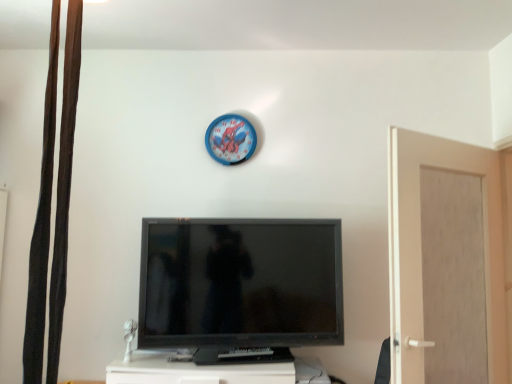
Question: From a real-world perspective, is blue plastic clock at upper center under beige matte door at right?

Choices:
 (A) no
 (B) yes

Answer: (A)

Question: Can you confirm if blue plastic clock at upper center is positioned to the right of beige matte door at right?

Choices:
 (A) yes
 (B) no

Answer: (B)

Question: From the image's perspective, is blue plastic clock at upper center below beige matte door at right?

Choices:
 (A) yes
 (B) no

Answer: (B)

Question: Could you tell me if blue plastic clock at upper center is turned towards beige matte door at right?

Choices:
 (A) no
 (B) yes

Answer: (A)

Question: Can you confirm if blue plastic clock at upper center is taller than beige matte door at right?

Choices:
 (A) yes
 (B) no

Answer: (B)

Question: From a real-world perspective, does blue plastic clock at upper center stand above beige matte door at right?

Choices:
 (A) yes
 (B) no

Answer: (A)

Question: Would you say black glossy television at center contains beige matte door at right?

Choices:
 (A) yes
 (B) no

Answer: (B)

Question: Is black glossy television at center beside beige matte door at right?

Choices:
 (A) no
 (B) yes

Answer: (A)

Question: Is black glossy television at center outside of beige matte door at right?

Choices:
 (A) yes
 (B) no

Answer: (A)

Question: From a real-world perspective, does black glossy television at center sit lower than beige matte door at right?

Choices:
 (A) no
 (B) yes

Answer: (B)

Question: Is black glossy television at center at the left side of beige matte door at right?

Choices:
 (A) yes
 (B) no

Answer: (A)

Question: From a real-world perspective, does black glossy television at center stand above beige matte door at right?

Choices:
 (A) no
 (B) yes

Answer: (A)

Question: Does black glossy television at center appear on the left side of blue plastic clock at upper center?

Choices:
 (A) yes
 (B) no

Answer: (B)